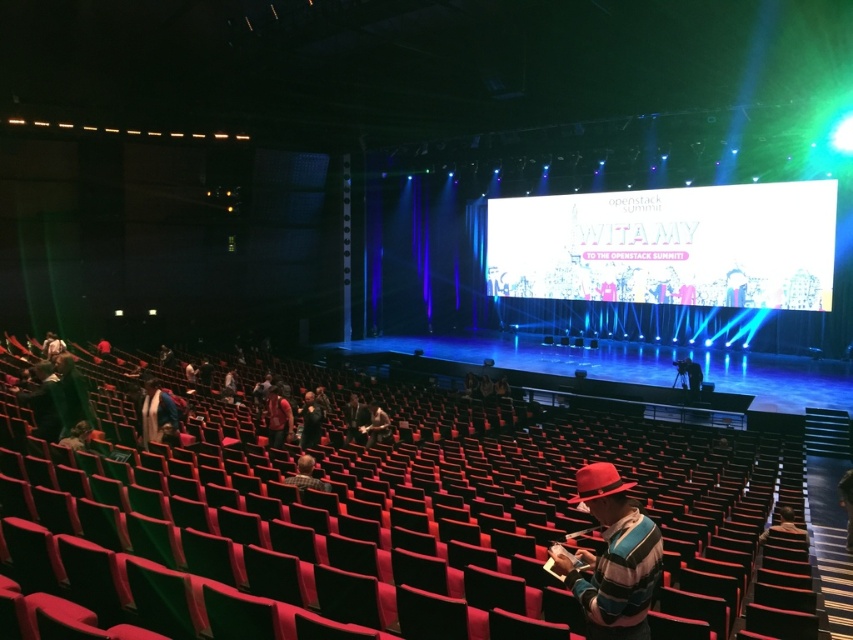
Question: Which object appears closest to the camera in this image?

Choices:
 (A) red felt hat at center
 (B) dark gray hoodie at center
 (C) plaid shirt at lower center
 (D) striped sweater at lower right

Answer: (A)

Question: Which object appears farthest from the camera in this image?

Choices:
 (A) striped sweater at lower right
 (B) red felt hat at center

Answer: (A)

Question: Which object appears closest to the camera in this image?

Choices:
 (A) white fabric at lower left
 (B) matte black jacket at center
 (C) plaid shirt at lower center
 (D) striped sweater at lower right

Answer: (C)

Question: Does red felt hat at lower right appear over matte black jacket at center?

Choices:
 (A) no
 (B) yes

Answer: (B)

Question: Does red felt hat at lower right have a smaller size compared to red felt hat at center?

Choices:
 (A) yes
 (B) no

Answer: (B)

Question: Is red felt hat at lower right further to the viewer compared to striped sweater at lower right?

Choices:
 (A) no
 (B) yes

Answer: (A)